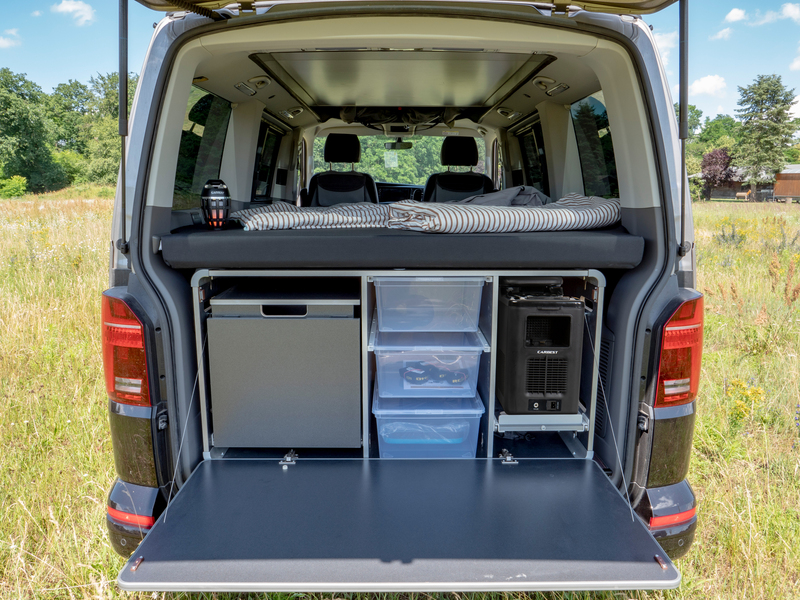
The width and height of the screenshot is (800, 600). In order to click on plastic bin in this screenshot , I will do `click(430, 313)`, `click(392, 370)`, `click(433, 438)`.